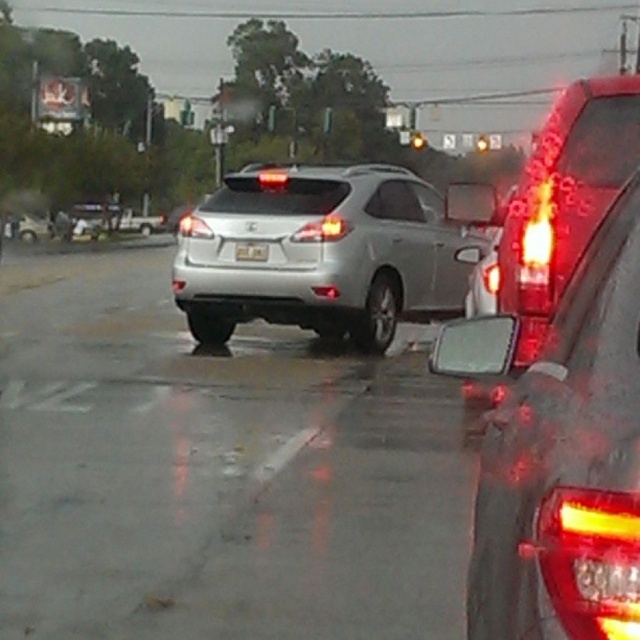
You are a delivery driver who needs to make a left turn at the upcoming intersection. The vehicle you are currently behind is the satin silver suv at center. Based on the scene, can you safely make the left turn before the SUV moves forward?

The satin silver suv at center is stopped at a traffic light, so it will remain stationary until the light turns green. You can safely make the left turn before the SUV moves forward as long as there is no oncoming traffic and enough space to complete the maneuver.

You are a driver trying to read the license plate number of the vehicle ahead. Given that the black plastic license plate at center is partially obscured by raindrops, can you see it clearly through the satin silver suv at center?

The satin silver suv at center is in front of the black plastic license plate at center, so the license plate is blocked by the SUV and cannot be seen clearly.

You are driving a car and see the satin silver suv at center ahead. Based on its position, can you estimate where it is located relative to the center of the image?

The satin silver suv at center is located at the center of the image since its 2D coordinates are at point [320,252], which is very close to the center point of an image typically represented as [320,320].